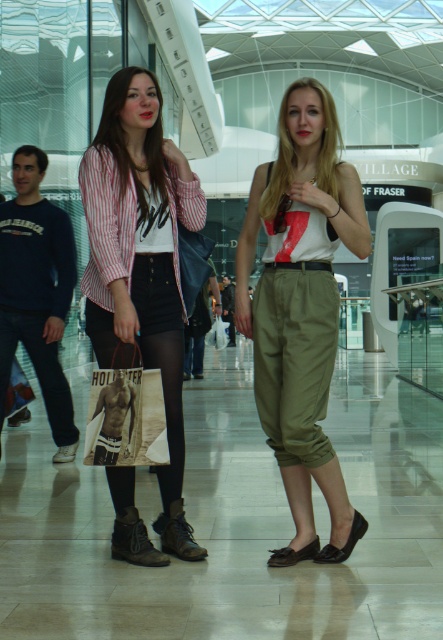
Question: Which object is closer to the camera taking this photo?

Choices:
 (A) striped cotton shirt at center
 (B) khaki cotton pants at center

Answer: (B)

Question: Is khaki cotton pants at center thinner than striped cotton shirt at center?

Choices:
 (A) yes
 (B) no

Answer: (B)

Question: Can you confirm if khaki cotton pants at center is smaller than striped cotton shirt at center?

Choices:
 (A) no
 (B) yes

Answer: (A)

Question: Can you confirm if khaki cotton pants at center is wider than striped cotton shirt at center?

Choices:
 (A) no
 (B) yes

Answer: (B)